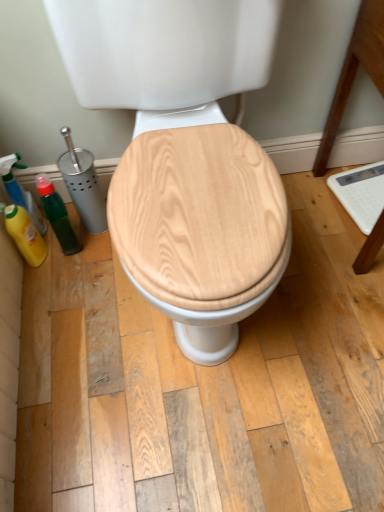
At what (x,y) coordinates should I click in order to perform the action: click on free spot behind yellow matte bottle at left, the 1th cleaning product positioned from the bottom. Please return your answer as a coordinate pair (x, y). Looking at the image, I should click on (x=62, y=230).